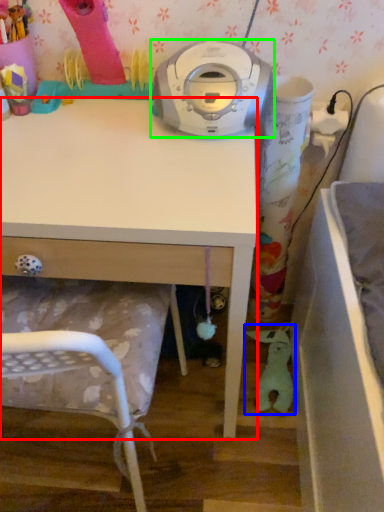
Question: Estimate the real-world distances between objects in this image. Which object is closer to desk (highlighted by a red box), toy (highlighted by a blue box) or home appliance (highlighted by a green box)?

Choices:
 (A) toy
 (B) home appliance

Answer: (B)